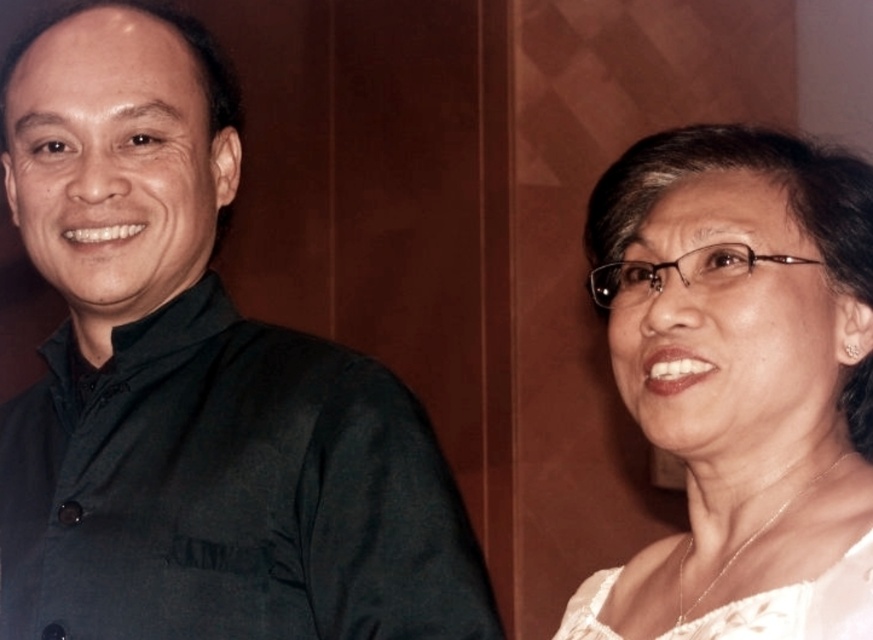
Can you confirm if dark green shirt at left is positioned to the left of white lace blouse at upper right?

Indeed, dark green shirt at left is positioned on the left side of white lace blouse at upper right.

Between point (334, 589) and point (782, 442), which one is positioned in front?

Point (782, 442) is in front.

Locate an element on the screen. dark green shirt at left is located at coordinates (193, 387).

Is point (297, 556) positioned after point (853, 572)?

Yes.

Locate an element on the screen. dark green shirt at left is located at coordinates click(193, 387).

Between white lace blouse at upper right and white lace dress at right, which one appears on the left side from the viewer's perspective?

white lace dress at right

In the scene shown: Who is more distant from viewer, (766,131) or (809,637)?

The point (766,131) is more distant.

Locate an element on the screen. The height and width of the screenshot is (640, 873). white lace blouse at upper right is located at coordinates (740, 384).